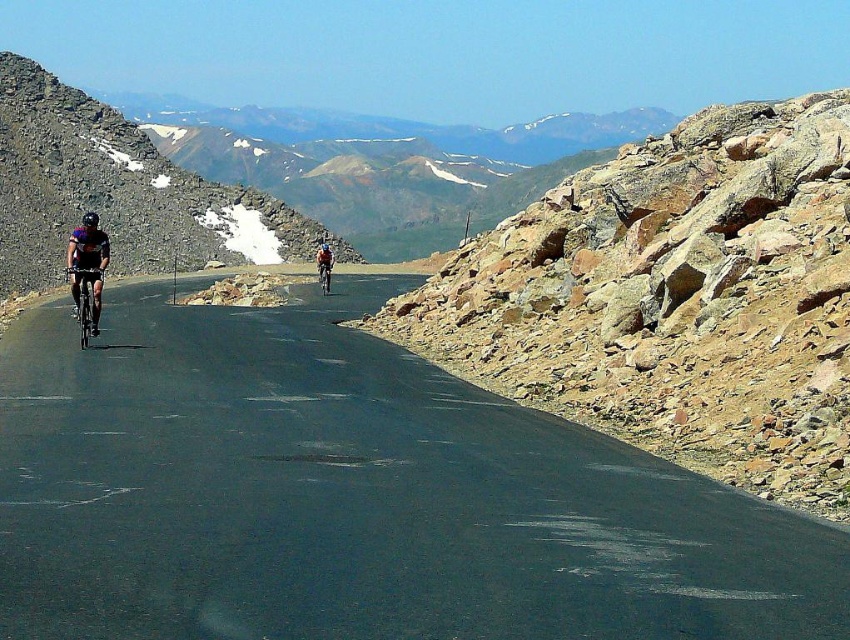
You are a hiker planning to walk along the black asphalt road at center. You notice the shiny metallic bicycle at center is parked on the road. Can you walk around it without stepping off the road?

The black asphalt road at center is taller than the shiny metallic bicycle at center, so the bicycle is lower than the road. This means the bicycle is likely placed on the road surface. Since the road is paved and curves gently, you can walk around the bicycle while staying on the road.

You are a cyclist on the mountain road and see the shiny black bicycle at left and the rocky gray mountain at left. Which object is closer to you?

The shiny black bicycle at left is behind the rocky gray mountain at left, so the mountain is closer to you.